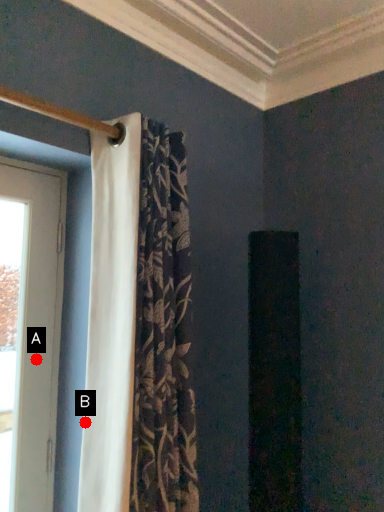
Question: Two points are circled on the image, labeled by A and B beside each circle. Among these points, which one is nearest to the camera?

Choices:
 (A) A is closer
 (B) B is closer

Answer: (B)